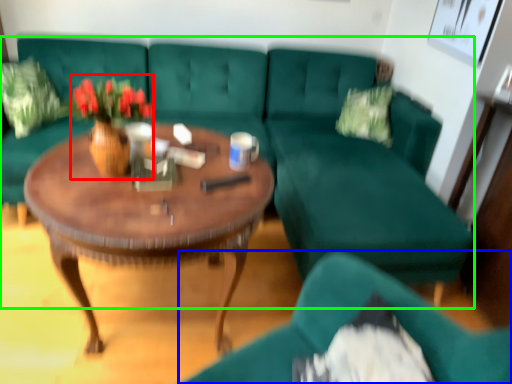
Question: Which object is the farthest from floral arrangement (highlighted by a red box)? Choose among these: chair (highlighted by a blue box) or studio couch (highlighted by a green box).

Choices:
 (A) chair
 (B) studio couch

Answer: (B)